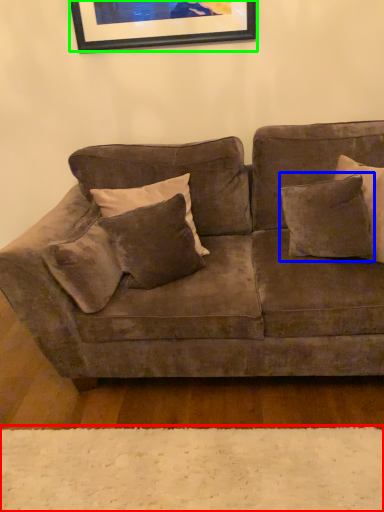
Question: Which is nearer to the plain (highlighted by a red box)? pillow (highlighted by a blue box) or picture frame (highlighted by a green box).

Choices:
 (A) pillow
 (B) picture frame

Answer: (A)